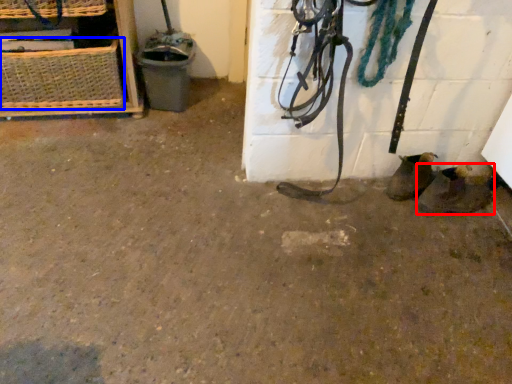
Question: Which point is closer to the camera, footwear (highlighted by a red box) or basket (highlighted by a blue box)?

Choices:
 (A) footwear
 (B) basket

Answer: (A)